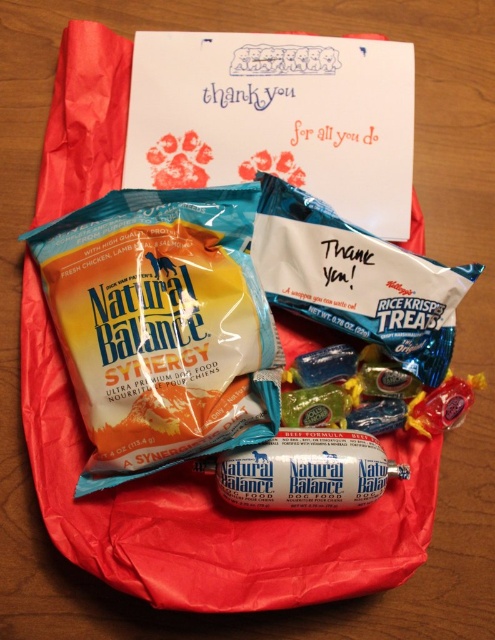
Question: Does blue matte bag of natural balance synergy at upper left appear over white glossy dog food at center?

Choices:
 (A) no
 (B) yes

Answer: (B)

Question: In this image, where is blue matte bag of natural balance synergy at upper left located relative to white glossy dog food at center?

Choices:
 (A) right
 (B) left

Answer: (B)

Question: Does blue matte bag of natural balance synergy at upper left have a greater width compared to white glossy dog food at center?

Choices:
 (A) yes
 (B) no

Answer: (A)

Question: Which point is closer to the camera taking this photo?

Choices:
 (A) (287, 497)
 (B) (167, 381)

Answer: (B)

Question: Which object is farther from the camera taking this photo?

Choices:
 (A) white glossy dog food at center
 (B) blue matte bag of natural balance synergy at upper left

Answer: (A)

Question: Which point is farther to the camera?

Choices:
 (A) white glossy dog food at center
 (B) blue matte bag of natural balance synergy at upper left

Answer: (A)